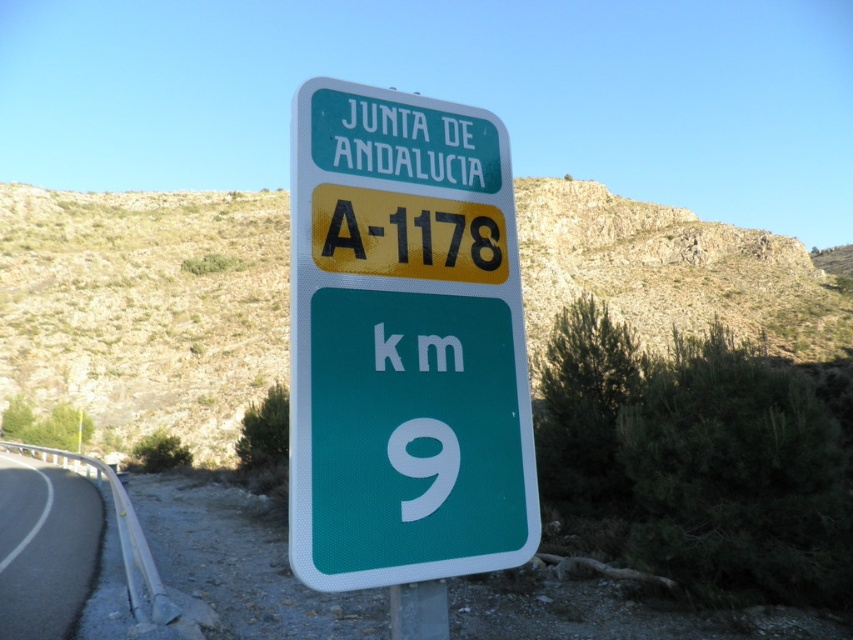
Between green plastic sign at center and black asphalt road at lower left, which one is positioned higher?

→ green plastic sign at center is higher up.

Is green plastic sign at center to the left of black asphalt road at lower left from the viewer's perspective?

Incorrect, green plastic sign at center is not on the left side of black asphalt road at lower left.

You are a GUI agent. You are given a task and a screenshot of the screen. Output one action in this format:
    pyautogui.click(x=<x>, y=<y>)
    Task: Click on the green plastic sign at center
    The width and height of the screenshot is (853, 640).
    Given the screenshot: What is the action you would take?
    click(x=404, y=342)